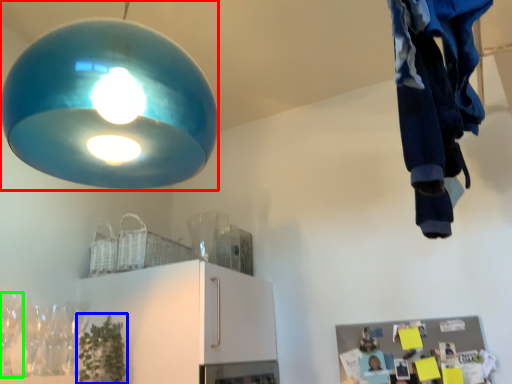
Question: Based on their relative distances, which object is farther from lamp (highlighted by a red box)? Choose from plant (highlighted by a blue box) and wine glass (highlighted by a green box).

Choices:
 (A) plant
 (B) wine glass

Answer: (A)